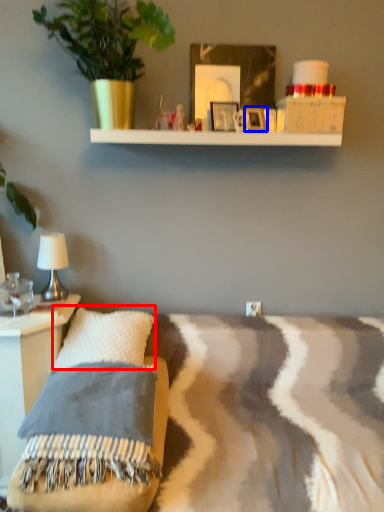
Question: Which of the following is the farthest to the observer, pillow (highlighted by a red box) or picture frame (highlighted by a blue box)?

Choices:
 (A) pillow
 (B) picture frame

Answer: (B)